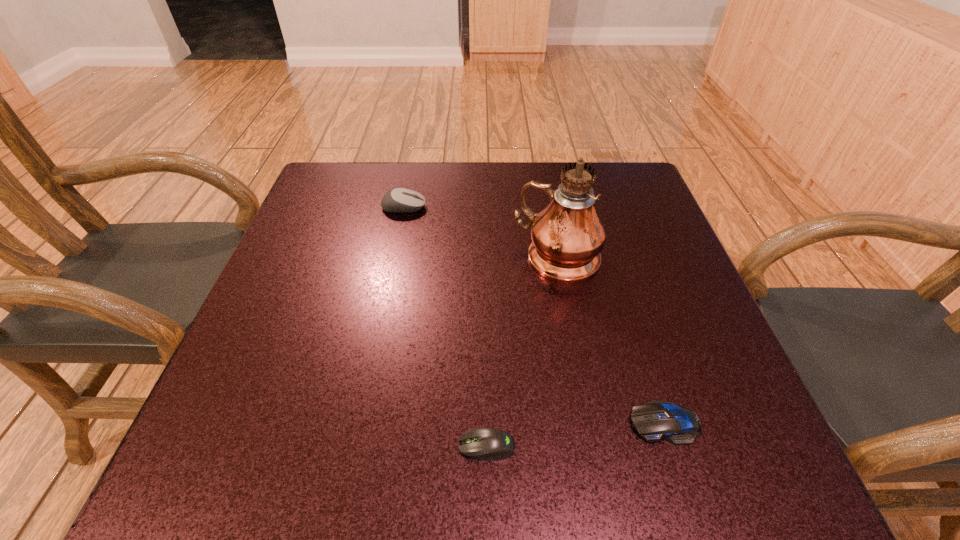
The height and width of the screenshot is (540, 960). Identify the location of the third nearest object. (567, 236).

The image size is (960, 540). What are the coordinates of `oil lamp` in the screenshot? It's located at (567, 236).

Locate an element on the screen. This screenshot has height=540, width=960. the farthest computer mouse is located at coordinates (399, 200).

The height and width of the screenshot is (540, 960). In order to click on the third shortest object in this screenshot , I will do `click(399, 200)`.

The width and height of the screenshot is (960, 540). In order to click on the rightmost computer mouse in this screenshot , I will do `click(658, 419)`.

The height and width of the screenshot is (540, 960). I want to click on the second computer mouse from right to left, so click(x=490, y=444).

Identify the location of vacant area situated on the front of the third nearest object. This screenshot has height=540, width=960. (582, 394).

Find the location of a particular element. blank space located 0.300m on the wheel side of the leftmost object is located at coordinates (549, 207).

You are a GUI agent. You are given a task and a screenshot of the screen. Output one action in this format:
    pyautogui.click(x=<x>, y=<y>)
    Task: Click on the blank area located 0.320m on the button side of the rightmost computer mouse
    The width and height of the screenshot is (960, 540).
    Given the screenshot: What is the action you would take?
    pyautogui.click(x=421, y=423)

The width and height of the screenshot is (960, 540). Find the location of `vacant space located on the button side of the rightmost computer mouse`. vacant space located on the button side of the rightmost computer mouse is located at coordinates (376, 423).